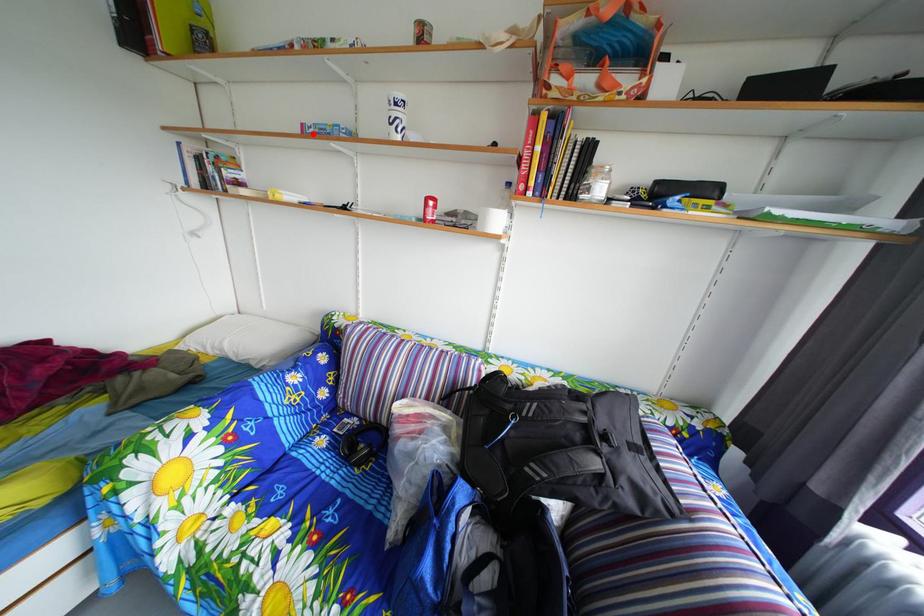
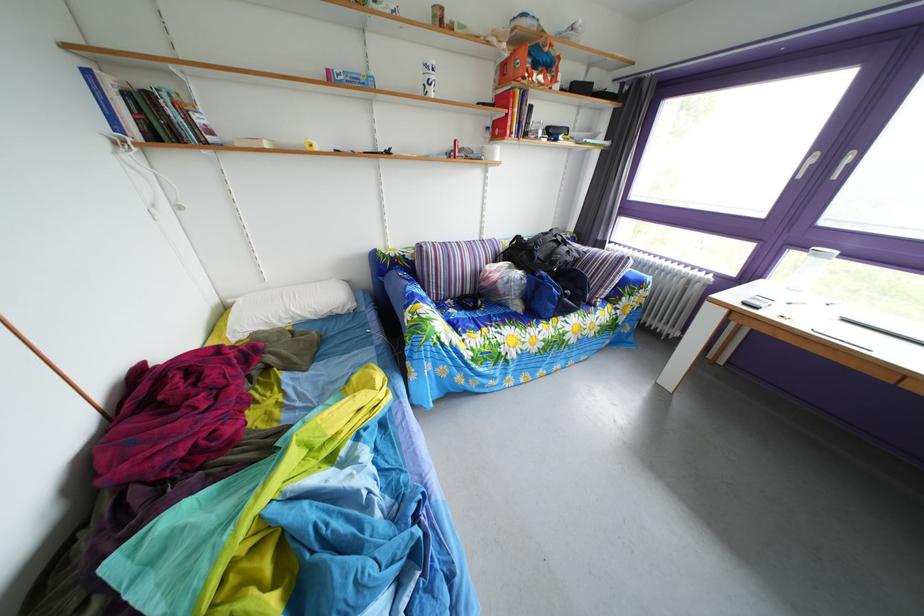
The point at the highlighted location is marked in the first image. Where is the corresponding point in the second image?

(339, 79)